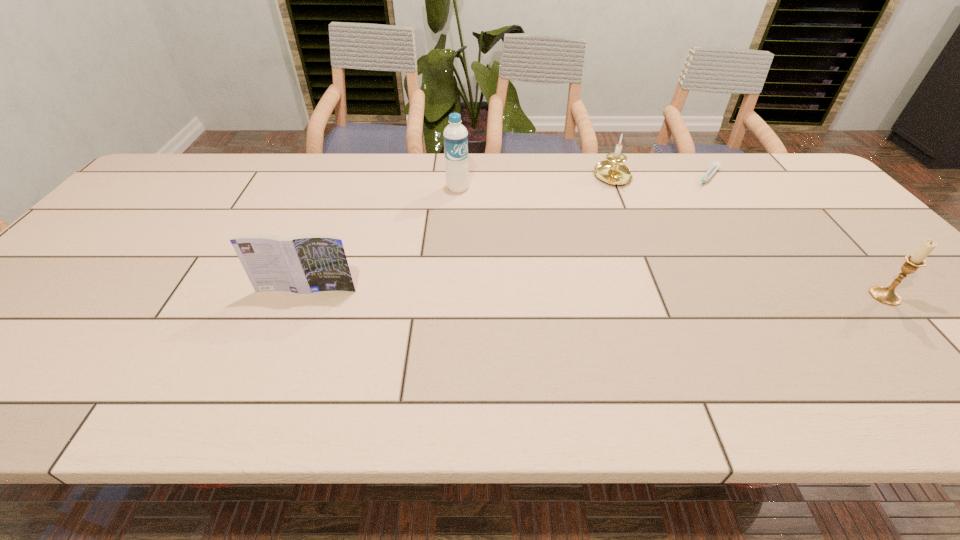
Where is `object that is the fourth nearest to the rightmost object`? Image resolution: width=960 pixels, height=540 pixels. object that is the fourth nearest to the rightmost object is located at coordinates (307, 263).

Point out which object is positioned as the fourth nearest to the left candle holder. Please provide its 2D coordinates. Your answer should be formatted as a tuple, i.e. [(x, y)], where the tuple contains the x and y coordinates of a point satisfying the conditions above.

[(307, 263)]

Find the location of a particular element. vacant space that satisfies the following two spatial constraints: 1. on the front cover of the book; 2. on the right side of the rightmost object is located at coordinates (304, 296).

Find the location of a particular element. The height and width of the screenshot is (540, 960). vacant space that satisfies the following two spatial constraints: 1. on the back side of the tallest object; 2. on the left side of the second object from right to left is located at coordinates (458, 179).

You are a GUI agent. You are given a task and a screenshot of the screen. Output one action in this format:
    pyautogui.click(x=<x>, y=<y>)
    Task: Click on the vacant region that satisfies the following two spatial constraints: 1. on the front side of the right candle holder; 2. on the right side of the third object from left to right
    The height and width of the screenshot is (540, 960).
    Given the screenshot: What is the action you would take?
    pyautogui.click(x=661, y=296)